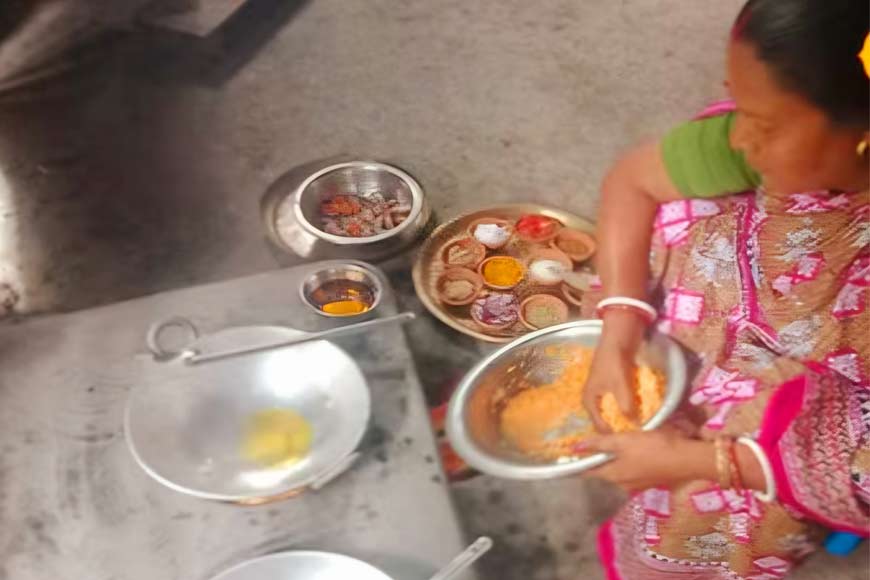
Where is `table`? table is located at coordinates (52, 511).